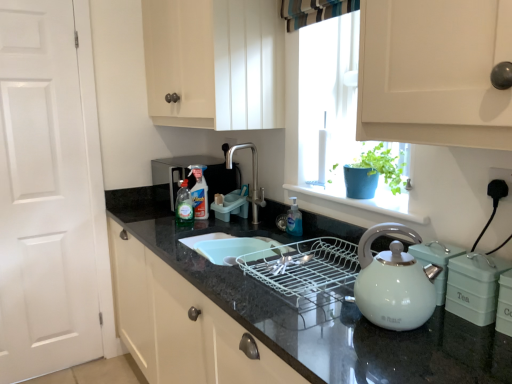
In order to face black plastic plug at lower right, should I rotate leftwards or rightwards?

Rotate your view right by about 31.344°.

The width and height of the screenshot is (512, 384). I want to click on blue matte pot at window, so click(x=373, y=173).

Find the location of a particular element. Image resolution: width=512 pixels, height=384 pixels. white glossy kettle at right is located at coordinates (393, 282).

What is the approximate width of translucent plastic bottle at center, arranged as the 3th bottle when viewed from the right?

translucent plastic bottle at center, arranged as the 3th bottle when viewed from the right, is 4.53 inches wide.

What are the coordinates of `translucent plastic bottle at center, the second bottle positioned from the back` in the screenshot? It's located at (184, 206).

Measure the distance between clear plastic bottle at center, the third bottle from the front, and camera.

clear plastic bottle at center, the third bottle from the front, and camera are 2.05 meters apart from each other.

What are the coordinates of `black granite countertop at center` in the screenshot? It's located at (315, 310).

Considering the positions of objects translucent plastic soap dispenser at center, the first bottle in the right-to-left sequence, and blue matte pot at window in the image provided, who is more to the right, translucent plastic soap dispenser at center, the first bottle in the right-to-left sequence, or blue matte pot at window?

Positioned to the right is blue matte pot at window.

Between translucent plastic soap dispenser at center, which is the 3th bottle in back-to-front order, and blue matte pot at window, which one is positioned behind?

translucent plastic soap dispenser at center, which is the 3th bottle in back-to-front order, is more distant.

From a real-world perspective, is translucent plastic soap dispenser at center, which is counted as the first bottle, starting from the front, physically above blue matte pot at window?

Incorrect, from a real-world perspective, translucent plastic soap dispenser at center, which is counted as the first bottle, starting from the front, is lower than blue matte pot at window.

Does translucent plastic soap dispenser at center, the first bottle in the right-to-left sequence, touch blue matte pot at window?

There is a gap between translucent plastic soap dispenser at center, the first bottle in the right-to-left sequence, and blue matte pot at window.

Measure the distance from black plastic plug at lower right to black granite countertop at center.

black plastic plug at lower right is 27.37 inches away from black granite countertop at center.

Is black plastic plug at lower right looking in the opposite direction of black granite countertop at center?

No.

Which is more to the left, black plastic plug at lower right or black granite countertop at center?

Positioned to the left is black granite countertop at center.

Is black plastic plug at lower right positioned beyond the bounds of black granite countertop at center?

Yes.

From a real-world perspective, between white plastic window sill at center and clear plastic bottle at center, arranged as the second bottle when viewed from the left, who is vertically higher?

white plastic window sill at center is physically above.

Does white plastic window sill at center turn towards clear plastic bottle at center, the second bottle in the right-to-left sequence?

No, white plastic window sill at center is not oriented towards clear plastic bottle at center, the second bottle in the right-to-left sequence.

Is the position of white plastic window sill at center less distant than that of clear plastic bottle at center, arranged as the second bottle when viewed from the left?

Yes, white plastic window sill at center is closer to the camera.

Consider the image. From a real-world perspective, does clear plastic bottle at center, which appears as the 1th bottle when viewed from the back, stand above blue matte pot at window?

Incorrect, from a real-world perspective, clear plastic bottle at center, which appears as the 1th bottle when viewed from the back, is lower than blue matte pot at window.

Considering the positions of objects clear plastic bottle at center, which appears as the 1th bottle when viewed from the back, and blue matte pot at window in the image provided, who is behind, clear plastic bottle at center, which appears as the 1th bottle when viewed from the back, or blue matte pot at window?

clear plastic bottle at center, which appears as the 1th bottle when viewed from the back, is behind.

Can you see clear plastic bottle at center, arranged as the second bottle when viewed from the left, touching blue matte pot at window?

No, clear plastic bottle at center, arranged as the second bottle when viewed from the left, is not in contact with blue matte pot at window.

Looking at their sizes, would you say clear plastic bottle at center, the second bottle in the right-to-left sequence, is wider or thinner than blue matte pot at window?

In the image, clear plastic bottle at center, the second bottle in the right-to-left sequence, appears to be more narrow than blue matte pot at window.

From the image's perspective, which is below, striped fabric curtain at upper center or black granite countertop at center?

black granite countertop at center, from the image's perspective.

From a real-world perspective, is striped fabric curtain at upper center physically above black granite countertop at center?

Correct, in the physical world, striped fabric curtain at upper center is higher than black granite countertop at center.

Could you tell me if striped fabric curtain at upper center is facing black granite countertop at center?

No, striped fabric curtain at upper center is not facing towards black granite countertop at center.

This screenshot has height=384, width=512. I want to click on countertop below the striped fabric curtain at upper center (from a real-world perspective), so click(315, 310).

Considering the positions of objects white matte door at left and white plastic window sill at center in the image provided, who is more to the left, white matte door at left or white plastic window sill at center?

white matte door at left.

Is white matte door at left turned away from white plastic window sill at center?

No, white matte door at left's orientation is not away from white plastic window sill at center.

Would you consider white matte door at left to be distant from white plastic window sill at center?

white matte door at left is positioned a significant distance from white plastic window sill at center.

Find the location of `door that appears behind the white plastic window sill at center`. door that appears behind the white plastic window sill at center is located at coordinates (47, 195).

Between black plastic plug at lower right and translucent plastic soap dispenser at center, which is the 3th bottle in back-to-front order, which one has less height?

black plastic plug at lower right is shorter.

Looking at this image, which is more to the right, black plastic plug at lower right or translucent plastic soap dispenser at center, positioned as the 3th bottle in left-to-right order?

From the viewer's perspective, black plastic plug at lower right appears more on the right side.

Considering the sizes of objects black plastic plug at lower right and translucent plastic soap dispenser at center, which is the 3th bottle in back-to-front order, in the image provided, who is bigger, black plastic plug at lower right or translucent plastic soap dispenser at center, which is the 3th bottle in back-to-front order,?

translucent plastic soap dispenser at center, which is the 3th bottle in back-to-front order, is bigger.

Do you think black plastic plug at lower right is within translucent plastic soap dispenser at center, positioned as the 3th bottle in left-to-right order, or outside of it?

black plastic plug at lower right lies outside translucent plastic soap dispenser at center, positioned as the 3th bottle in left-to-right order.

From a real-world perspective, starting from the blue matte pot at window, which bottle is the 3rd one below it? Please provide its 2D coordinates.

[(294, 219)]

Locate an element on the screen. The width and height of the screenshot is (512, 384). countertop below the black plastic plug at lower right (from the image's perspective) is located at coordinates (315, 310).

Looking at the image, which one is located further to blue matte pot at window, white glossy kettle at right or white plastic window sill at center?

white glossy kettle at right is positioned further to the anchor blue matte pot at window.

From the image, which object appears to be nearer to translucent plastic soap dispenser at center, which is counted as the first bottle, starting from the front, black granite countertop at center or translucent plastic bottle at center, arranged as the 3th bottle when viewed from the right?

Based on the image, black granite countertop at center appears to be nearer to translucent plastic soap dispenser at center, which is counted as the first bottle, starting from the front.

Based on their spatial positions, is black granite countertop at center or white matte door at left further from white plastic window sill at center?

The object further to white plastic window sill at center is white matte door at left.

Based on their spatial positions, is green matte tea canister at right, the 2th appliance from the right, or white ceramic container at lower right, which appears as the 3th appliance when viewed from the left, closer to white matte door at left?

green matte tea canister at right, the 2th appliance from the right, is closer to white matte door at left.

Which object lies nearer to the anchor point clear plastic bottle at center, the third bottle from the front, clear plastic dish soap at center, the first appliance when ordered from left to right, or white glossy kettle at right?

clear plastic dish soap at center, the first appliance when ordered from left to right, lies closer to clear plastic bottle at center, the third bottle from the front, than the other object.

From the picture: Considering their positions, is white matte door at left positioned further to translucent plastic bottle at center, the second bottle positioned from the back, than polished stainless steel faucet at center?

Among the two, white matte door at left is located further to translucent plastic bottle at center, the second bottle positioned from the back.

When comparing their distances from clear plastic dish soap at center, which appears as the third appliance when viewed from the right, does clear plastic bottle at center, the third bottle from the front, or white ceramic container at lower right, which is counted as the third appliance, starting from the back, seem further?

Based on the image, white ceramic container at lower right, which is counted as the third appliance, starting from the back, appears to be further to clear plastic dish soap at center, which appears as the third appliance when viewed from the right.

When comparing their distances from clear plastic bottle at center, the second bottle in the right-to-left sequence, does striped fabric curtain at upper center or white plastic window sill at center seem further?

The object further to clear plastic bottle at center, the second bottle in the right-to-left sequence, is striped fabric curtain at upper center.

You are a GUI agent. You are given a task and a screenshot of the screen. Output one action in this format:
    pyautogui.click(x=<x>, y=<y>)
    Task: Click on the curtain located between green matte tea canister at right, which is the 2th appliance from front to back, and clear plastic bottle at center, the second bottle in the right-to-left sequence, in the depth direction
    This screenshot has width=512, height=384.
    Given the screenshot: What is the action you would take?
    pyautogui.click(x=314, y=11)

Locate an element on the screen. This screenshot has width=512, height=384. appliance between white ceramic container at lower right, which is counted as the third appliance, starting from the back, and blue matte pot at window in the front-back direction is located at coordinates (474, 287).

Identify the location of bottle situated between polished stainless steel faucet at center and blue matte pot at window from left to right. The height and width of the screenshot is (384, 512). pyautogui.click(x=294, y=219).

This screenshot has width=512, height=384. I want to click on tap located between white matte door at left and blue matte pot at window in the left-right direction, so click(x=252, y=177).